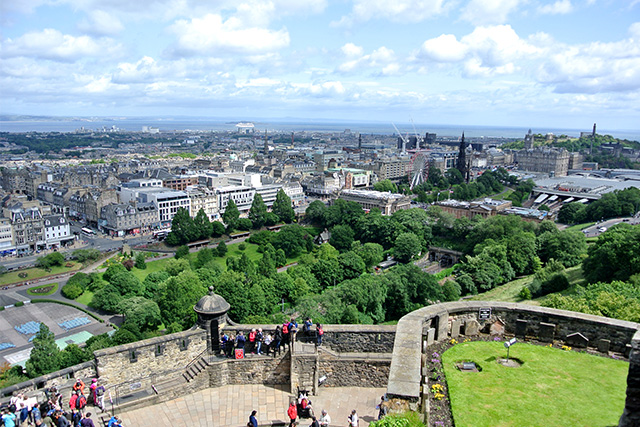
I want to click on finial, so click(x=211, y=287).